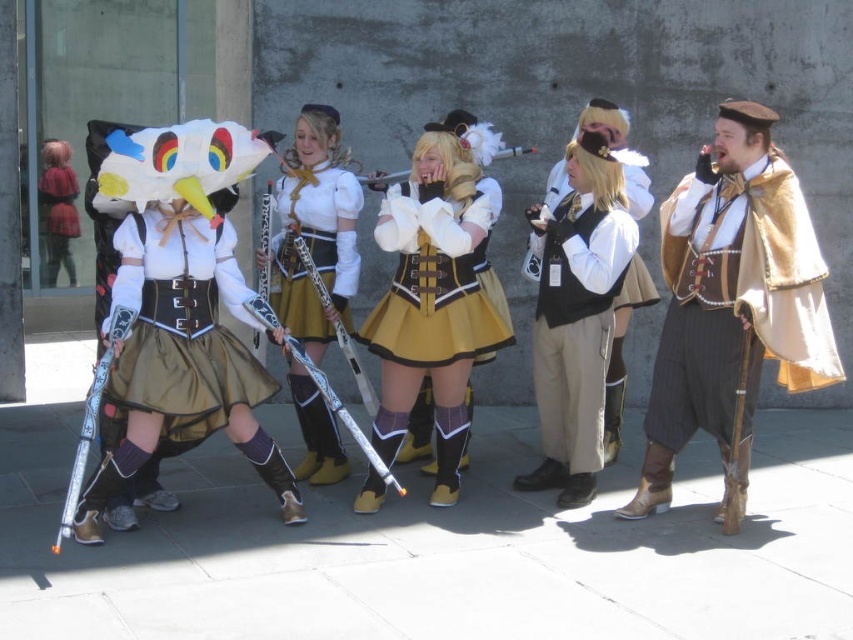
Question: Which point is farther from the camera taking this photo?

Choices:
 (A) (515, 428)
 (B) (438, 353)

Answer: (A)

Question: Is gold satin skirt at center thinner than black velvet vest at center?

Choices:
 (A) no
 (B) yes

Answer: (A)

Question: Does gold satin skirt at center have a lesser width compared to matte white skirt at center?

Choices:
 (A) yes
 (B) no

Answer: (B)

Question: Which point is closer to the camera?

Choices:
 (A) tap(469, 336)
 (B) tap(595, 467)
 (C) tap(689, 410)

Answer: (A)

Question: From the image, what is the correct spatial relationship of gray concrete pavement at center in relation to black velvet vest at center?

Choices:
 (A) left
 (B) right

Answer: (A)

Question: Which point appears farthest from the camera in this image?

Choices:
 (A) (554, 528)
 (B) (467, 177)

Answer: (B)